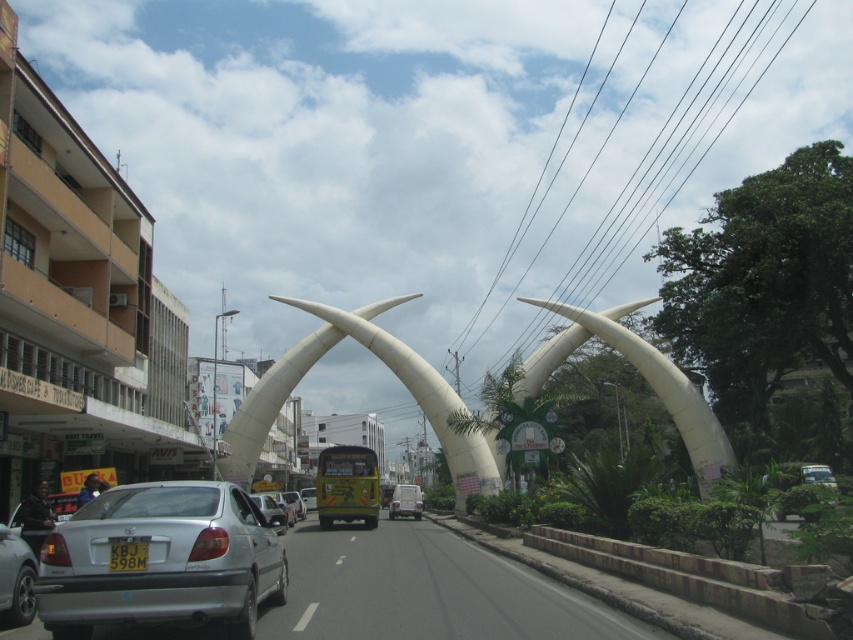
Question: Which point appears farthest from the camera in this image?

Choices:
 (A) (123, 500)
 (B) (413, 500)
 (C) (109, 566)

Answer: (B)

Question: Is black plastic license plate at center thinner than metallic silver van at center?

Choices:
 (A) yes
 (B) no

Answer: (A)

Question: Which point appears closest to the camera in this image?

Choices:
 (A) click(32, 580)
 (B) click(120, 570)
 (C) click(270, 570)
 (D) click(405, 493)

Answer: (B)

Question: Which of the following is the closest to the observer?

Choices:
 (A) metallic silver van at center
 (B) silver metallic car at center
 (C) silver metallic car at lower left

Answer: (C)

Question: Does silver metallic car at center appear on the left side of black plastic license plate at center?

Choices:
 (A) no
 (B) yes

Answer: (A)

Question: Does silver metallic car at center appear under black plastic license plate at center?

Choices:
 (A) yes
 (B) no

Answer: (A)